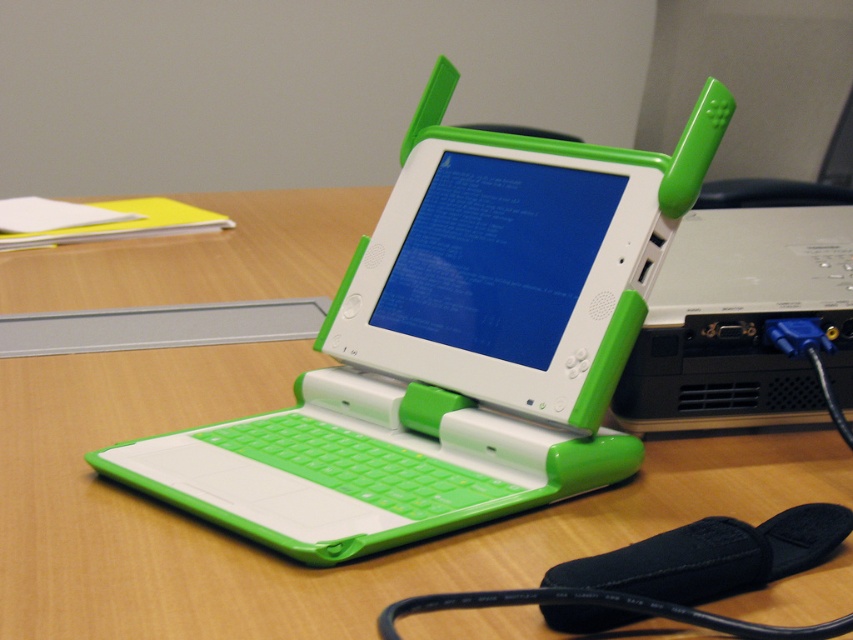
Is green matte laptop at center wider than white plastic computer at center?

Yes, green matte laptop at center is wider than white plastic computer at center.

Which is in front, point (422, 353) or point (761, 401)?

Positioned in front is point (761, 401).

Locate an element on the screen. This screenshot has height=640, width=853. green matte laptop at center is located at coordinates (453, 346).